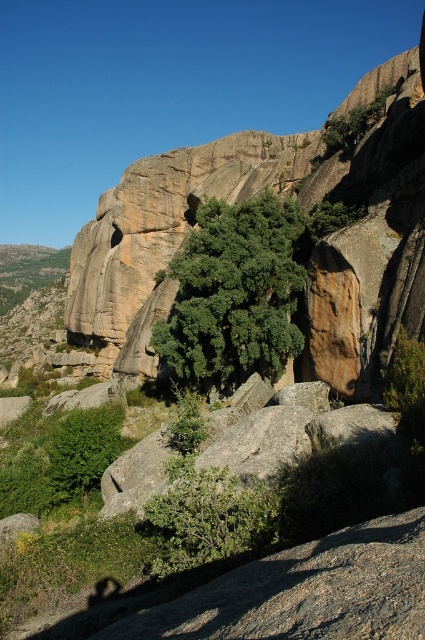
You are a hiker trying to navigate through the rocky terrain. You notice the green leafy bush at center and the green leafy tree at upper center. Which of these two plants takes up more space in the landscape?

The green leafy tree at upper center occupies more space than the green leafy bush at center according to the description.

Based on the photo, you are standing in the rugged landscape and see the green leafy tree at center and the green leafy tree at upper center. Which tree is closer to you?

The green leafy tree at center is closer to you because it is in front of the green leafy tree at upper center.